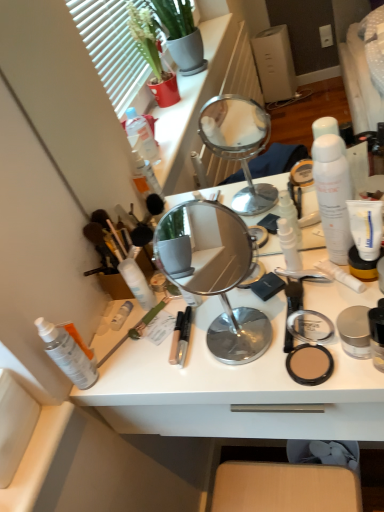
Find the location of a particular element. The height and width of the screenshot is (512, 384). blank space to the left of polished silver mirror at center is located at coordinates (155, 361).